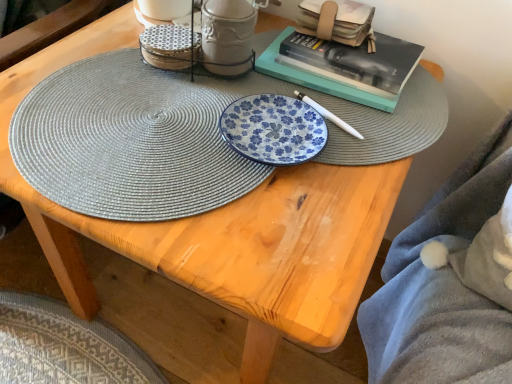
Find the location of a particular element. vacant area on top of matte gray woven placemat at center (from a real-world perspective) is located at coordinates [x=150, y=123].